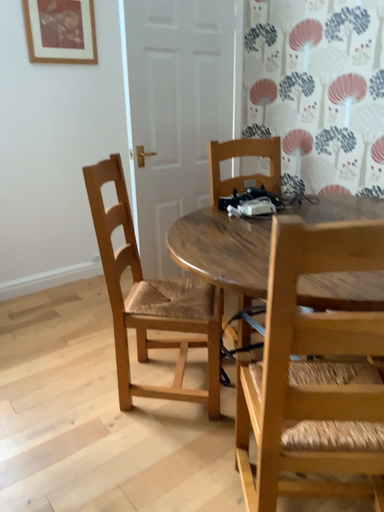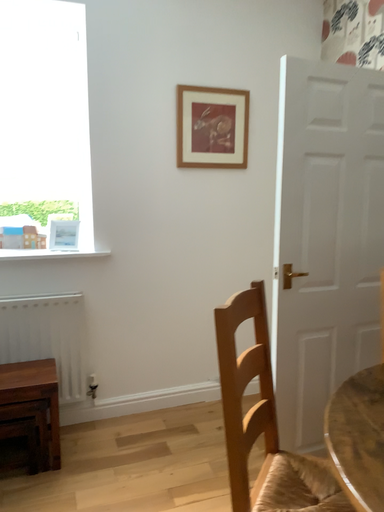
Question: Which way did the camera rotate in the video?

Choices:
 (A) rotated downward
 (B) rotated upward

Answer: (B)